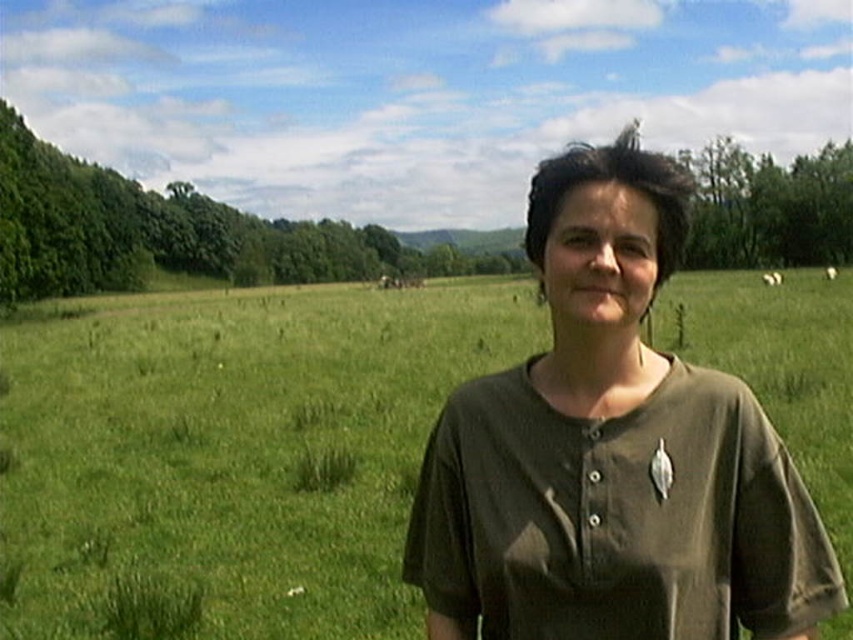
Who is positioned more to the left, green grass pasture at center or olive-green cotton shirt at center?

Positioned to the left is olive-green cotton shirt at center.

Can you confirm if green grass pasture at center is thinner than olive-green cotton shirt at center?

Incorrect, green grass pasture at center's width is not less than olive-green cotton shirt at center's.

Which is behind, point (233, 305) or point (589, 250)?

Point (233, 305)

Identify the location of green grass pasture at center. (235, 449).